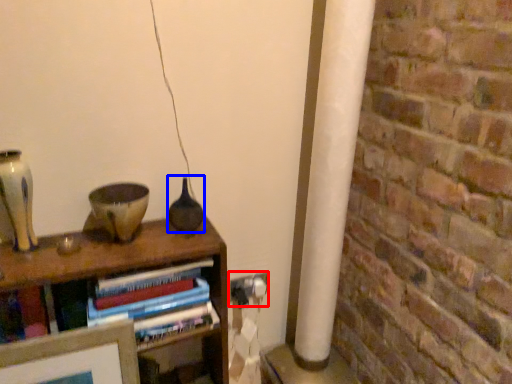
Question: Which object appears closest to the camera in this image, electric outlet (highlighted by a red box) or glass vase (highlighted by a blue box)?

Choices:
 (A) electric outlet
 (B) glass vase

Answer: (B)